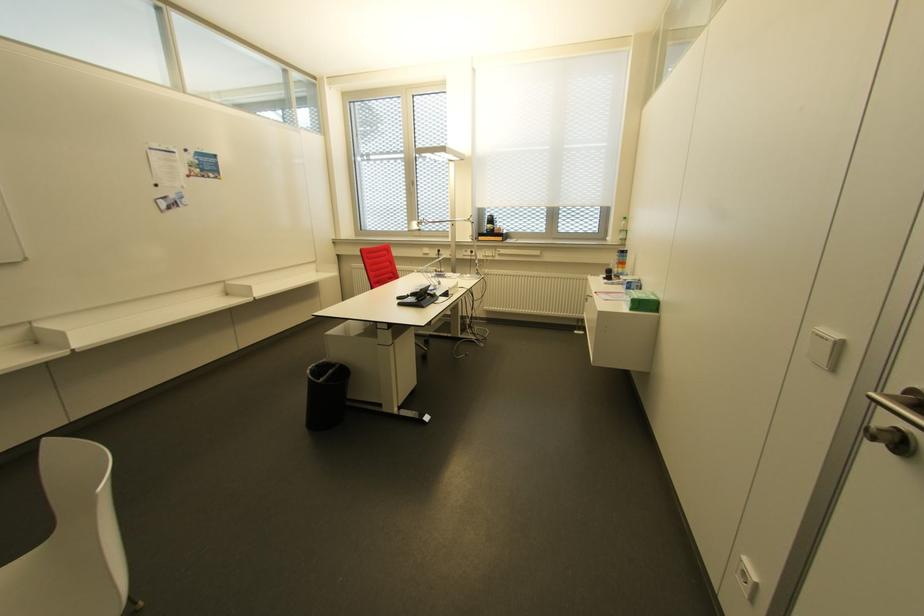
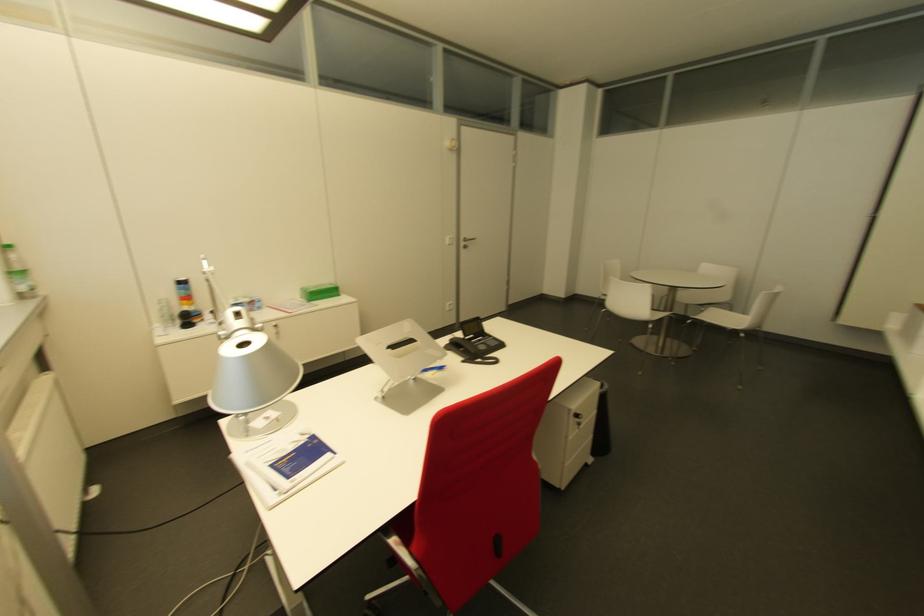
The point at [618,237] is marked in the first image. Where is the corresponding point in the second image?

(27, 284)